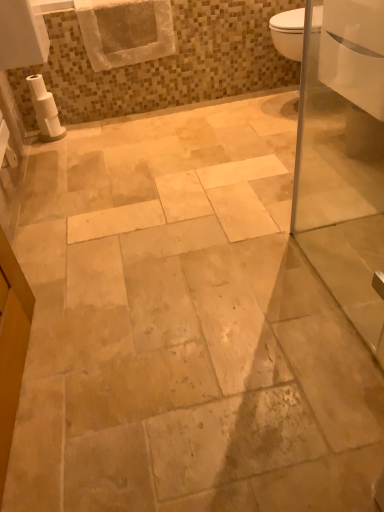
At what (x,y) coordinates should I click in order to perform the action: click on white matte toilet paper at left. Please return your answer as a coordinate pair (x, y). Looking at the image, I should click on (45, 109).

The image size is (384, 512). Describe the element at coordinates (45, 109) in the screenshot. I see `white matte toilet paper at left` at that location.

At what (x,y) coordinates should I click in order to perform the action: click on white matte toilet paper at left. Please return your answer as a coordinate pair (x, y). The width and height of the screenshot is (384, 512). Looking at the image, I should click on (45, 109).